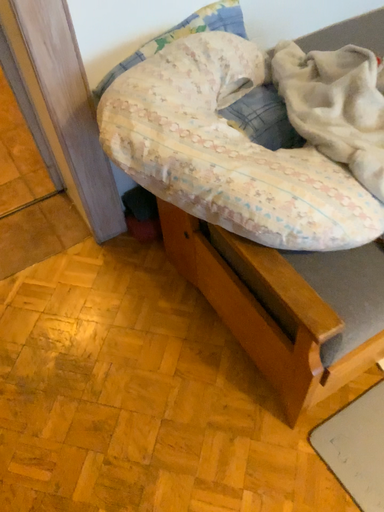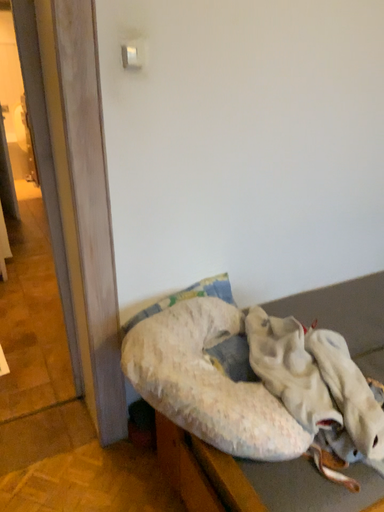
Question: How did the camera likely rotate when shooting the video?

Choices:
 (A) rotated upward
 (B) rotated downward

Answer: (A)